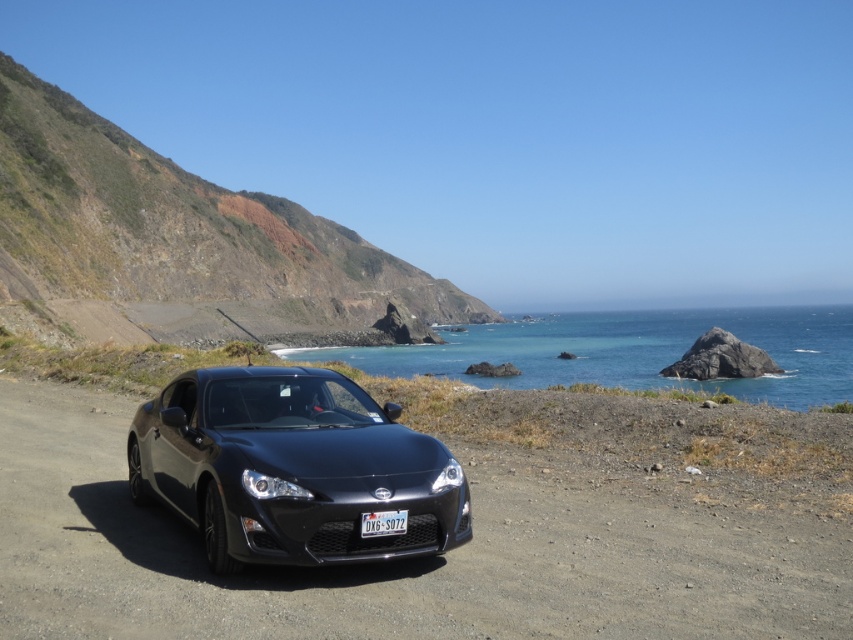
You are standing at the camera position and want to take a photo of the glossy black car at center. The camera has a maximum focus range of 12 feet. Will the car be in focus?

The glossy black car at center and camera are 13.15 feet apart from each other. Since the maximum focus range is 12 feet, the car is slightly out of range and may not be in focus.

You are a photographer trying to capture a closeup of the black plastic license plate at center while keeping the glossy black car at center in the background. Can you position yourself so that the distance between you and the license plate is 1.78 meters while still framing the car in the shot?

The glossy black car at center is 1.78 meters from the black plastic license plate at center. To capture the closeup, you can position yourself 1.78 meters away from the license plate. Since the car is only 1.78 meters behind the license plate, it will naturally be in the background of the photo as long as your camera angle includes both the license plate and the car.